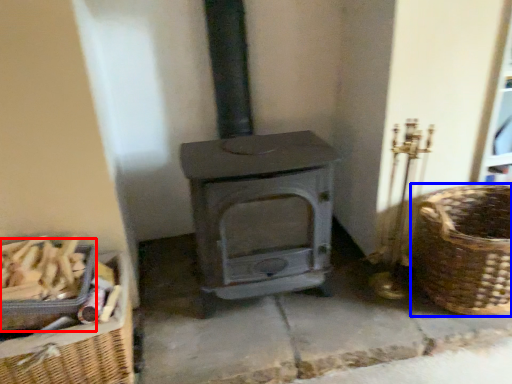
Question: Among these objects, which one is nearest to the camera, basket (highlighted by a red box) or basket (highlighted by a blue box)?

Choices:
 (A) basket
 (B) basket

Answer: (A)